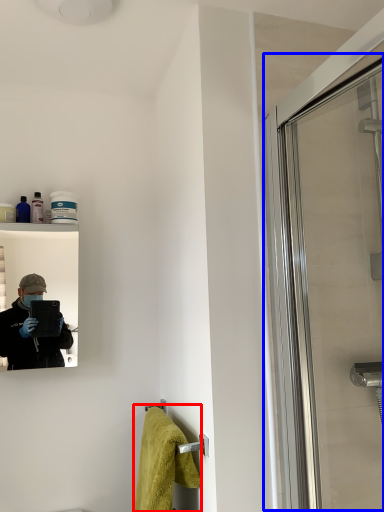
Question: Which of the following is the closest to the observer, bath towel (highlighted by a red box) or screen door (highlighted by a blue box)?

Choices:
 (A) bath towel
 (B) screen door

Answer: (B)